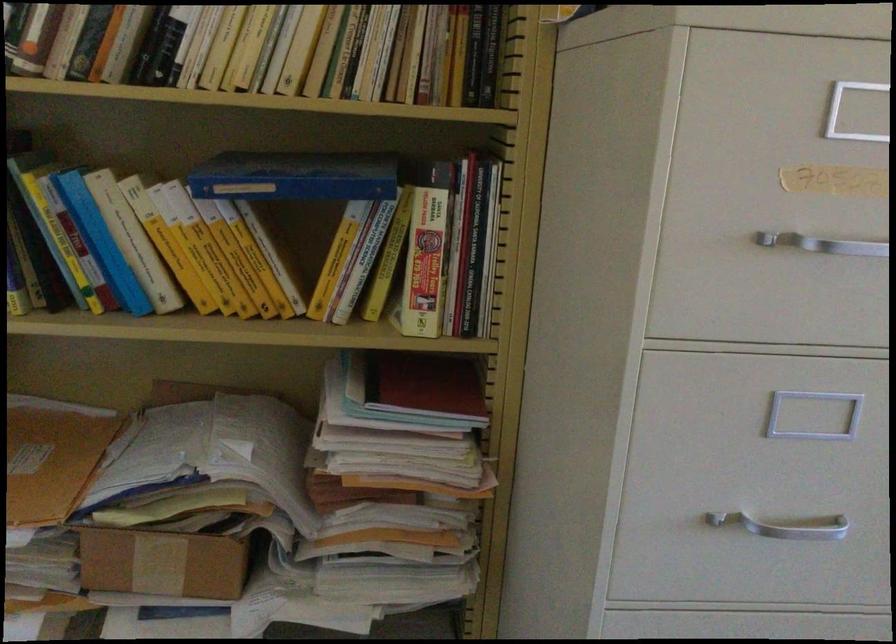
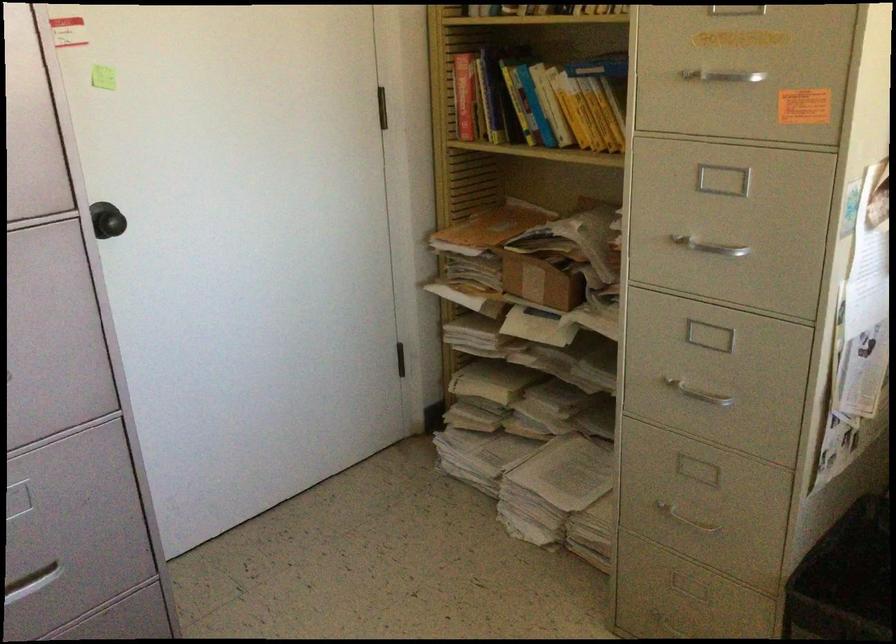
In the second image, find the point that corresponds to (202,563) in the first image.

(539, 281)